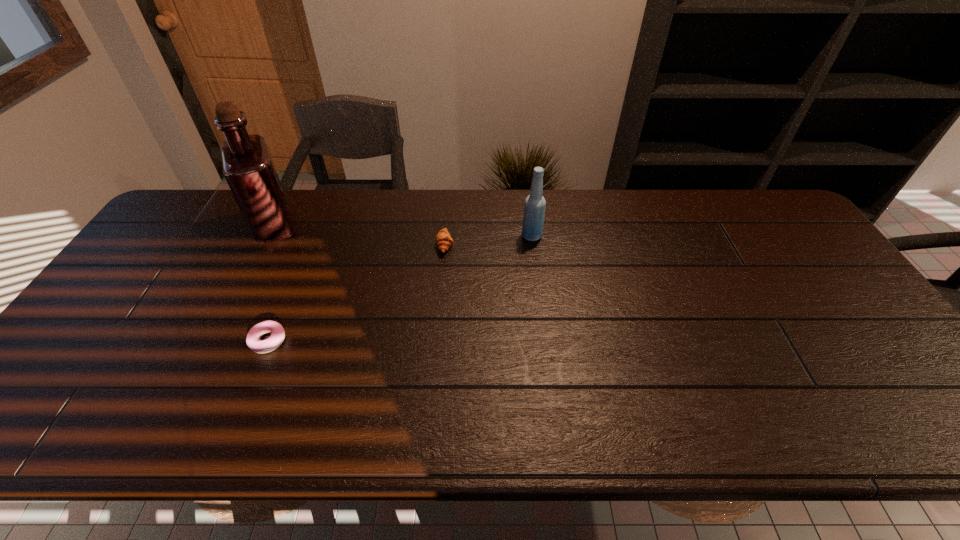
The image size is (960, 540). In order to click on vacant area that lies between the second object from right to left and the shorter pastry in this screenshot , I will do `click(356, 293)`.

Identify the location of vacant point located between the right pastry and the tallest object. This screenshot has width=960, height=540. (360, 235).

The height and width of the screenshot is (540, 960). Identify the location of free space between the right pastry and the bottle. (489, 240).

You are a GUI agent. You are given a task and a screenshot of the screen. Output one action in this format:
    pyautogui.click(x=<x>, y=<y>)
    Task: Click on the free space between the tallest object and the third object from left to right
    The height and width of the screenshot is (540, 960).
    Given the screenshot: What is the action you would take?
    pyautogui.click(x=360, y=235)

Identify the location of unoccupied area between the liquor and the nearer pastry. The image size is (960, 540). (272, 284).

Locate an element on the screen. The image size is (960, 540). vacant space in between the liquor and the third tallest object is located at coordinates (360, 235).

The height and width of the screenshot is (540, 960). I want to click on unoccupied area between the bottle and the liquor, so click(x=403, y=231).

I want to click on vacant space that's between the liquor and the shorter pastry, so click(272, 284).

Identify which object is the second nearest to the shortest object. Please provide its 2D coordinates. Your answer should be formatted as a tuple, i.e. [(x, y)], where the tuple contains the x and y coordinates of a point satisfying the conditions above.

[(443, 239)]

The width and height of the screenshot is (960, 540). I want to click on object that is the second closest one to the rightmost object, so click(x=253, y=341).